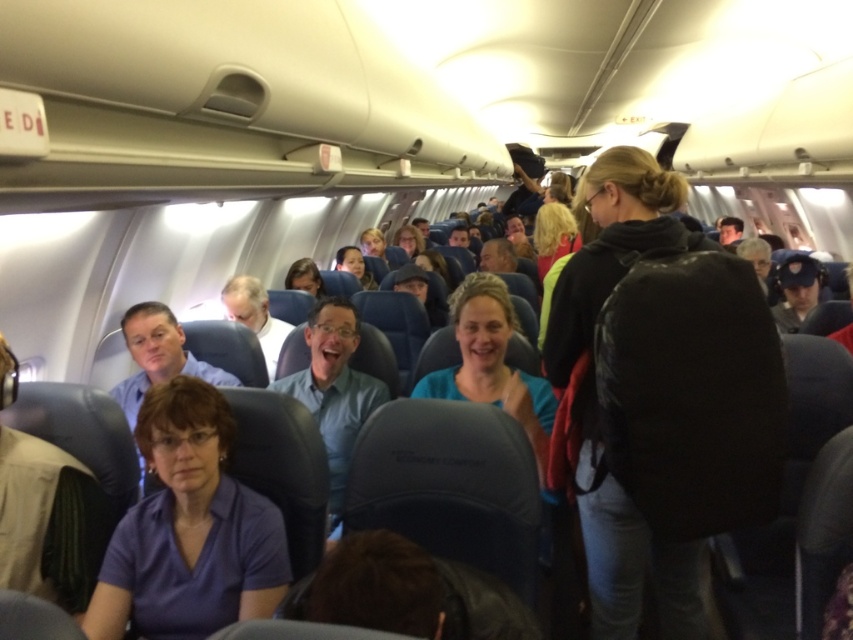
Who is positioned more to the right, black leather jacket at upper right or light blue shirt at center?

black leather jacket at upper right is more to the right.

Can you confirm if black leather jacket at upper right is thinner than light blue shirt at center?

No, black leather jacket at upper right is not thinner than light blue shirt at center.

Locate an element on the screen. black leather jacket at upper right is located at coordinates (662, 394).